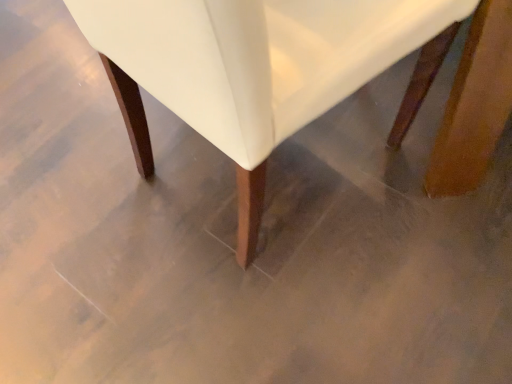
Where is `vacant region to the left of matte white chair at center`? Image resolution: width=512 pixels, height=384 pixels. vacant region to the left of matte white chair at center is located at coordinates (64, 181).